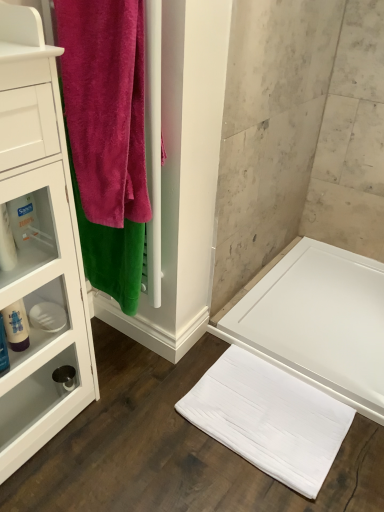
Locate an element on the screen. empty space that is ontop of white glossy bath at lower right is located at coordinates (314, 302).